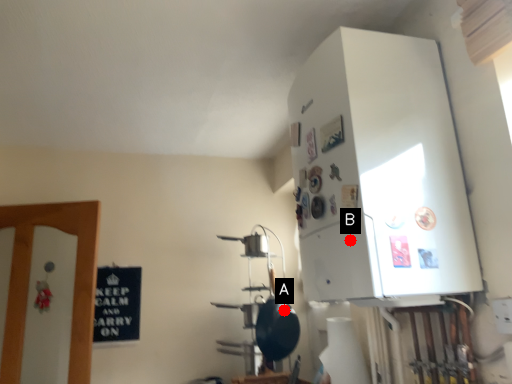
Question: Two points are circled on the image, labeled by A and B beside each circle. Among these points, which one is nearest to the camera?

Choices:
 (A) A is closer
 (B) B is closer

Answer: (B)